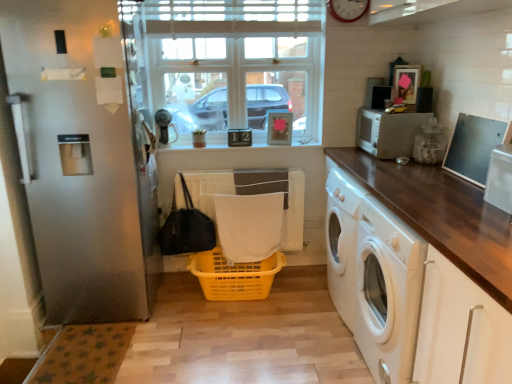
The image size is (512, 384). In order to click on free space to the left of metallic silver microwave at right in this screenshot , I will do `click(458, 208)`.